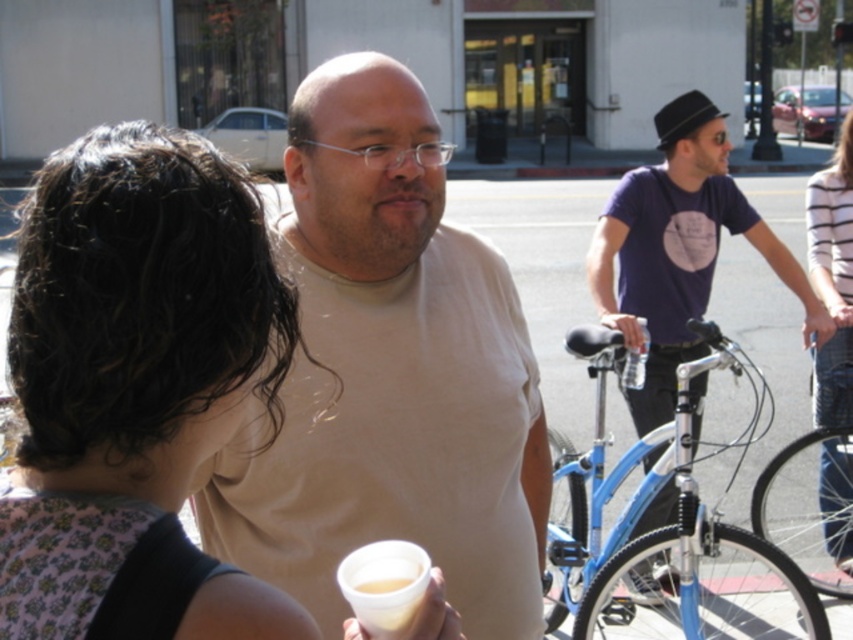
You are a delivery person who needs to place a small package on either the floral fabric dress at center or the translucent plastic cup at lower center. Which object is tall enough to support the package without it toppling over?

The floral fabric dress at center is taller than the translucent plastic cup at lower center, so the package should be placed on the floral fabric dress at center to avoid toppling over.

You are standing at the point with coordinates point (816, 406) and want to walk towards point (407, 588). Which direction should you face to move towards your destination?

Since point (816, 406) is closer to you than point (407, 588), you should face towards the lower right direction to move towards point (407, 588).

You are a delivery person who needs to place a small package between the striped cotton shirt at right and the translucent plastic cup at lower center. Can you fit it there?

The striped cotton shirt at right is taller than the translucent plastic cup at lower center, so there is vertical space between them. The small package can be placed there as long as its height doesn